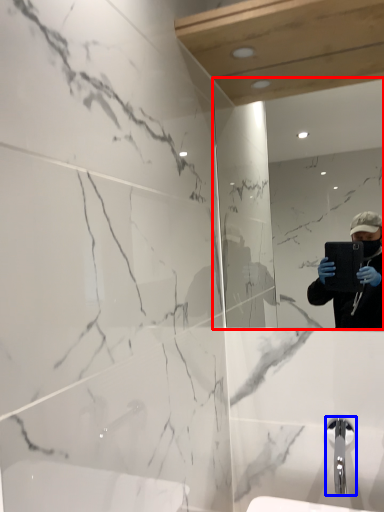
Question: Which point is closer to the camera, mirror (highlighted by a red box) or tap (highlighted by a blue box)?

Choices:
 (A) mirror
 (B) tap

Answer: (B)